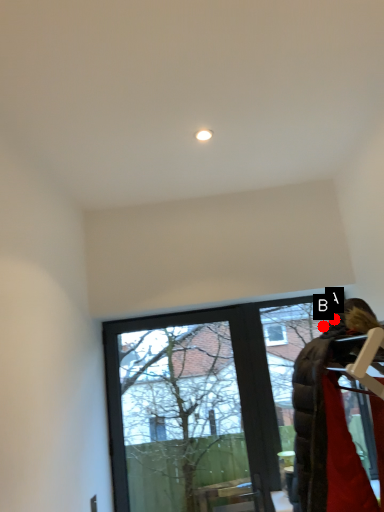
Question: Two points are circled on the image, labeled by A and B beside each circle. Which point is closer to the camera?

Choices:
 (A) A is closer
 (B) B is closer

Answer: (A)